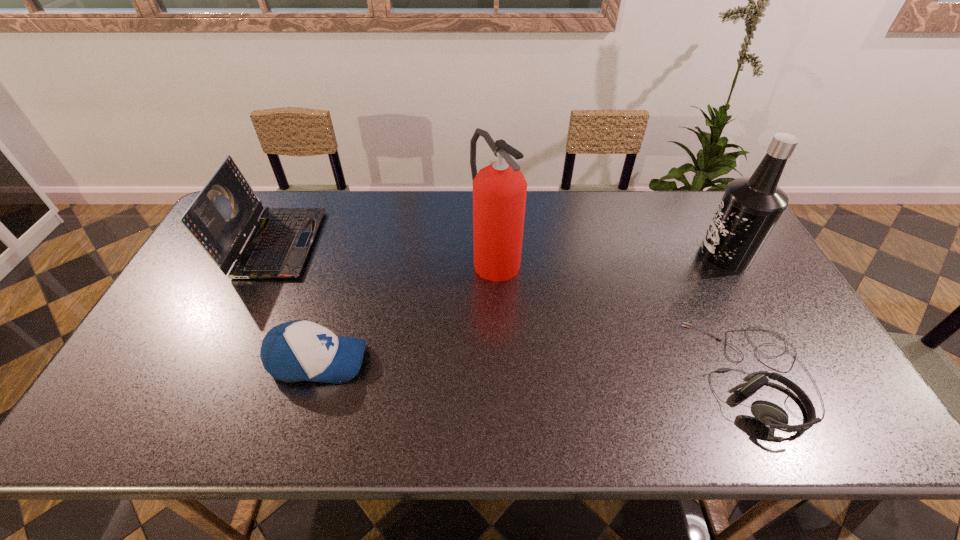
In order to click on liquor located at the right edge in this screenshot , I will do `click(750, 207)`.

Locate an element on the screen. The width and height of the screenshot is (960, 540). headset that is positioned at the right edge is located at coordinates (773, 416).

The width and height of the screenshot is (960, 540). Find the location of `object located in the far left corner section of the desktop`. object located in the far left corner section of the desktop is located at coordinates (222, 216).

This screenshot has height=540, width=960. Identify the location of object that is at the near right corner. pyautogui.click(x=773, y=416).

In the image, there is a desktop. Where is `free space at the far edge`? free space at the far edge is located at coordinates (597, 217).

You are a GUI agent. You are given a task and a screenshot of the screen. Output one action in this format:
    pyautogui.click(x=<x>, y=<y>)
    Task: Click on the free space at the near edge
    The height and width of the screenshot is (540, 960).
    Given the screenshot: What is the action you would take?
    pyautogui.click(x=420, y=403)

I want to click on vacant space at the left edge of the desktop, so click(x=173, y=317).

In the image, there is a desktop. Identify the location of free space at the far left corner. (269, 201).

Find the location of a particular element. The image size is (960, 540). free region at the far right corner of the desktop is located at coordinates (703, 200).

The height and width of the screenshot is (540, 960). What are the coordinates of `free space between the shortest object and the fourth tallest object` in the screenshot? It's located at click(537, 368).